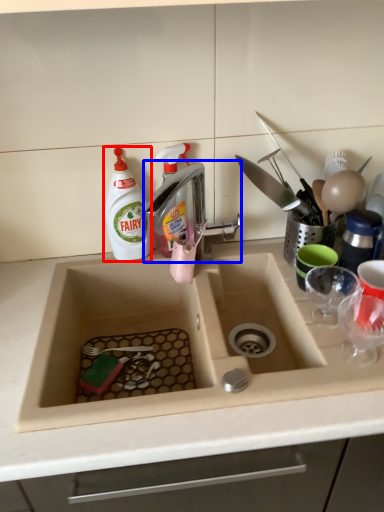
Question: Which of the following is the closest to the observer, cleaning product (highlighted by a red box) or tap (highlighted by a blue box)?

Choices:
 (A) cleaning product
 (B) tap

Answer: (B)